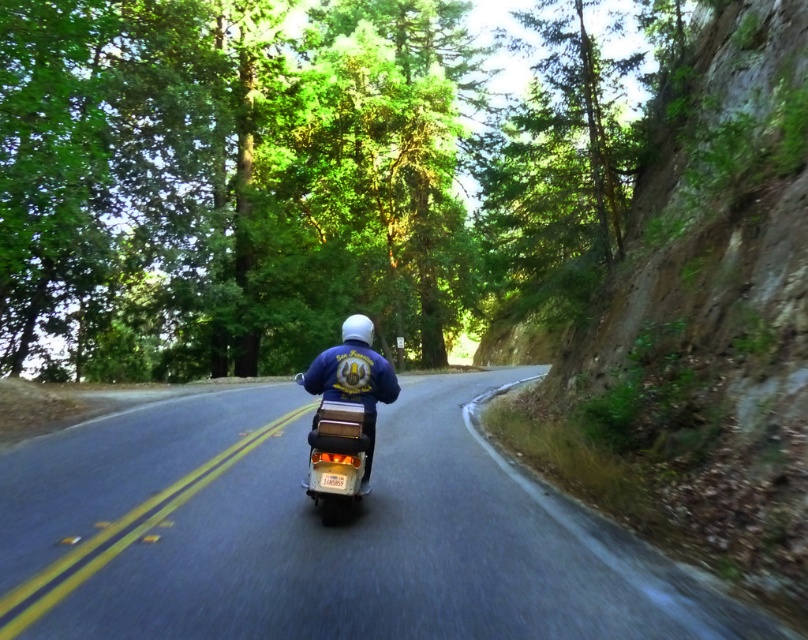
Does black asphalt road at center have a lesser height compared to blue denim jacket at center?

In fact, black asphalt road at center may be taller than blue denim jacket at center.

Who is lower down, black asphalt road at center or blue denim jacket at center?

black asphalt road at center

Is point (128, 531) more distant than point (344, 321)?

No, it is in front of (344, 321).

Locate an element on the screen. black asphalt road at center is located at coordinates (322, 534).

Who is shorter, metallic silver motorcycle at center or blue denim jacket at center?

Standing shorter between the two is blue denim jacket at center.

Is metallic silver motorcycle at center wider than blue denim jacket at center?

Yes.

Is point (339, 432) more distant than point (343, 376)?

No, it is in front of (343, 376).

Locate an element on the screen. The image size is (808, 640). metallic silver motorcycle at center is located at coordinates (337, 458).

Is black asphalt road at center to the left of metallic silver motorcycle at center from the viewer's perspective?

Indeed, black asphalt road at center is positioned on the left side of metallic silver motorcycle at center.

Between black asphalt road at center and metallic silver motorcycle at center, which one is positioned higher?

metallic silver motorcycle at center is higher up.

Between point (396, 625) and point (344, 465), which one is positioned in front?

Point (396, 625) is in front.

Where is `black asphalt road at center`? The width and height of the screenshot is (808, 640). black asphalt road at center is located at coordinates (322, 534).